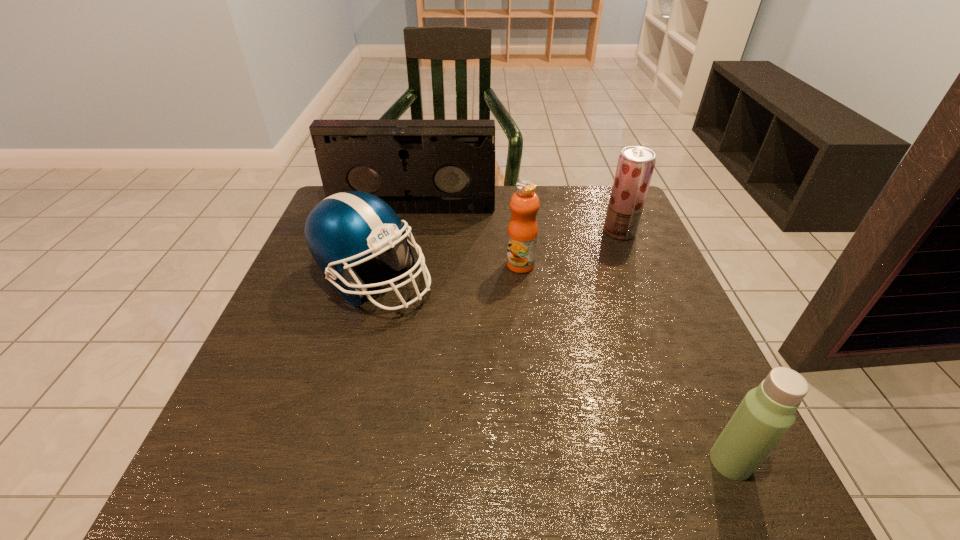
The width and height of the screenshot is (960, 540). I want to click on vacant space that satisfies the following two spatial constraints: 1. on the front side of the fourth nearest object; 2. on the left side of the videotape, so click(x=408, y=232).

This screenshot has height=540, width=960. I want to click on free space that satisfies the following two spatial constraints: 1. on the front side of the farthest object; 2. at the front of the football helmet with the faceguard, so click(397, 281).

Where is `free space that satisfies the following two spatial constraints: 1. on the front side of the videotape; 2. on the right side of the nearest object`? Image resolution: width=960 pixels, height=540 pixels. free space that satisfies the following two spatial constraints: 1. on the front side of the videotape; 2. on the right side of the nearest object is located at coordinates (360, 462).

Locate an element on the screen. vacant space that satisfies the following two spatial constraints: 1. on the front side of the thermos bottle; 2. on the left side of the videotape is located at coordinates (360, 462).

You are a GUI agent. You are given a task and a screenshot of the screen. Output one action in this format:
    pyautogui.click(x=<x>, y=<y>)
    Task: Click on the vacant area in the image that satisfies the following two spatial constraints: 1. on the front side of the videotape; 2. on the right side of the right fruit juice
    
    Given the screenshot: What is the action you would take?
    pyautogui.click(x=408, y=232)

Find the location of `free space that satisfies the following two spatial constraints: 1. on the front side of the third object from left to right; 2. on the right side of the videotape`. free space that satisfies the following two spatial constraints: 1. on the front side of the third object from left to right; 2. on the right side of the videotape is located at coordinates (401, 265).

Locate an element on the screen. free space that satisfies the following two spatial constraints: 1. on the front side of the nearer fruit juice; 2. on the left side of the farthest object is located at coordinates (401, 265).

Locate an element on the screen. vacant region that satisfies the following two spatial constraints: 1. on the front side of the nearest object; 2. on the left side of the videotape is located at coordinates (360, 462).